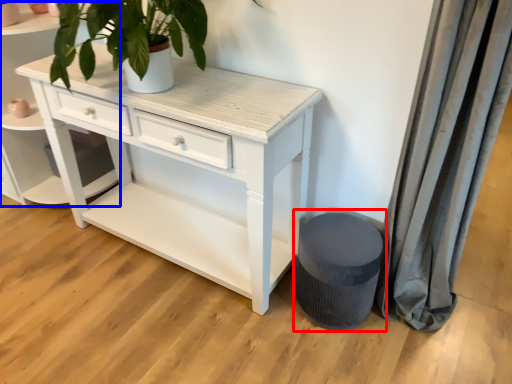
Question: Which object appears farthest to the camera in this image, music stool (highlighted by a red box) or shelf (highlighted by a blue box)?

Choices:
 (A) music stool
 (B) shelf

Answer: (B)